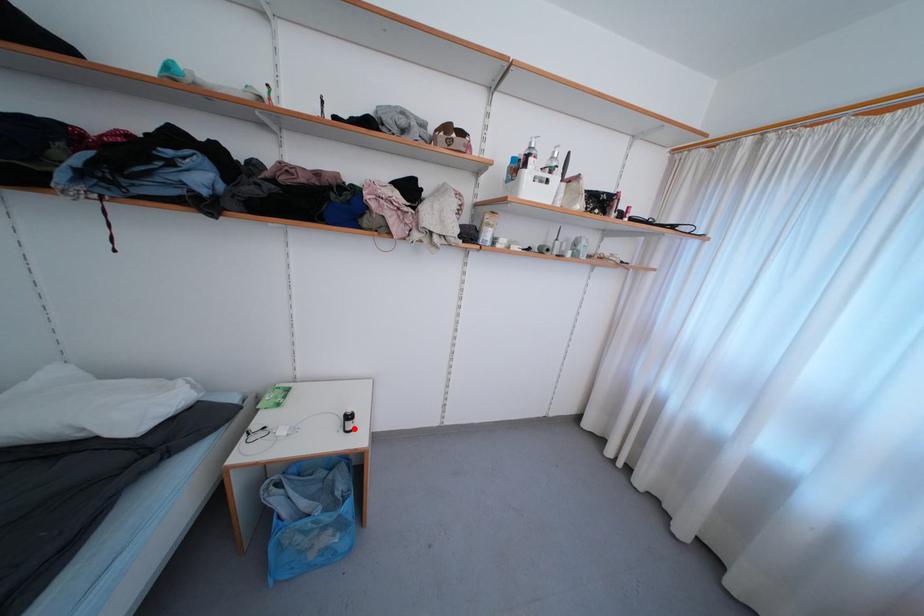
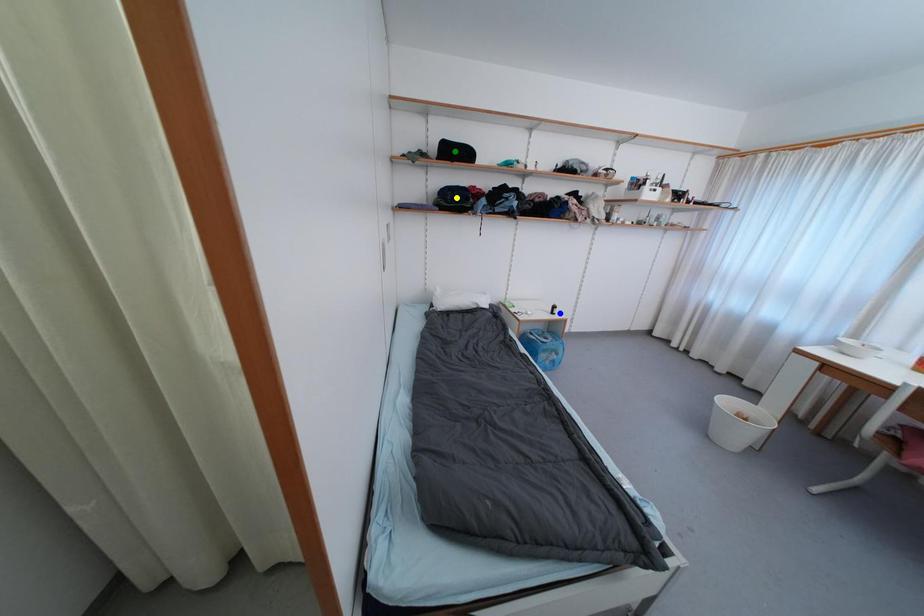
Question: I am providing you with two images of the same scene from different viewpoints. A red point is marked on the first image. You are given multiple points on the second image. Can you choose the point in image 2 that corresponds to the point in image 1?

Choices:
 (A) blue point
 (B) yellow point
 (C) green point

Answer: (A)